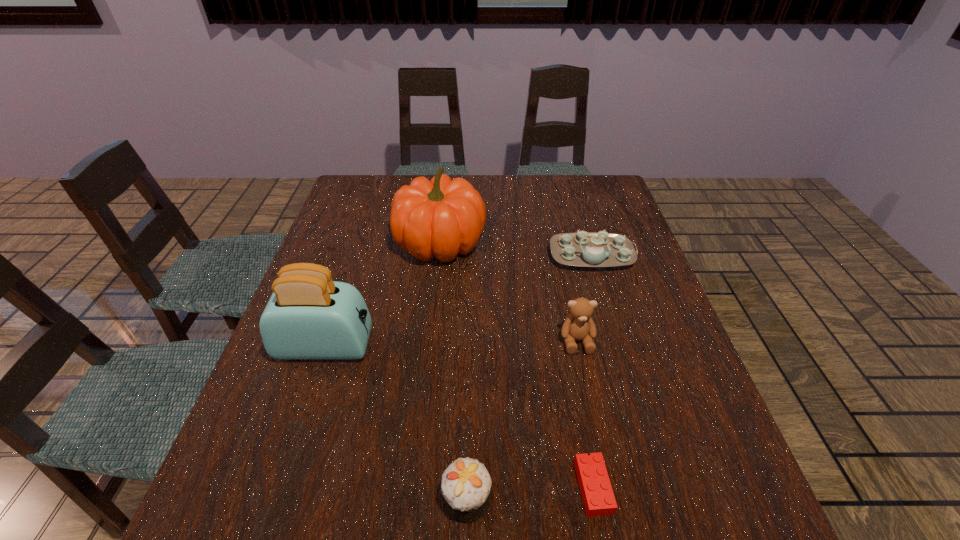
I want to click on blank space located on the back of the cupcake, so click(470, 355).

This screenshot has width=960, height=540. What are the coordinates of `vacant space located on the back of the shortest object` in the screenshot? It's located at (559, 305).

Locate an element on the screen. Image resolution: width=960 pixels, height=540 pixels. cupcake located in the near edge section of the desktop is located at coordinates (466, 484).

This screenshot has height=540, width=960. In order to click on Lego at the near edge in this screenshot , I will do `click(597, 494)`.

You are a GUI agent. You are given a task and a screenshot of the screen. Output one action in this format:
    pyautogui.click(x=<x>, y=<y>)
    Task: Click on the object present at the left edge
    The height and width of the screenshot is (540, 960).
    Given the screenshot: What is the action you would take?
    pyautogui.click(x=309, y=316)

Identify the location of object that is positioned at the right edge. (583, 249).

Where is `vacant space at the far edge`? The width and height of the screenshot is (960, 540). vacant space at the far edge is located at coordinates (559, 190).

You are a GUI agent. You are given a task and a screenshot of the screen. Output one action in this format:
    pyautogui.click(x=<x>, y=<y>)
    Task: Click on the vacant space at the left edge of the desktop
    This screenshot has width=960, height=540.
    Given the screenshot: What is the action you would take?
    pyautogui.click(x=283, y=450)

Identify the location of free region at the right edge. The width and height of the screenshot is (960, 540). (709, 421).

In the image, there is a desktop. At what (x,y) coordinates should I click in order to perform the action: click on vacant area at the far left corner. Please return your answer as a coordinate pair (x, y). This screenshot has height=540, width=960. Looking at the image, I should click on (349, 190).